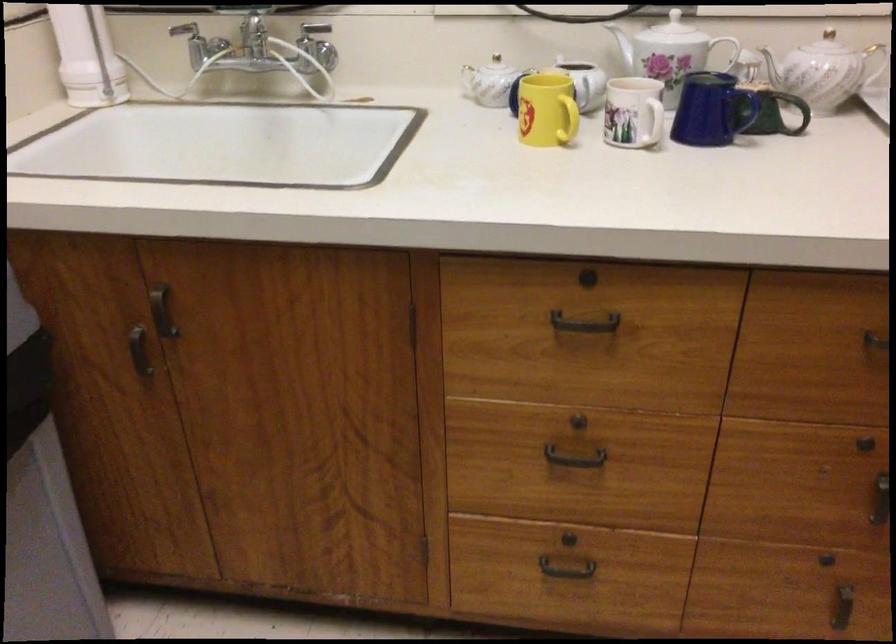
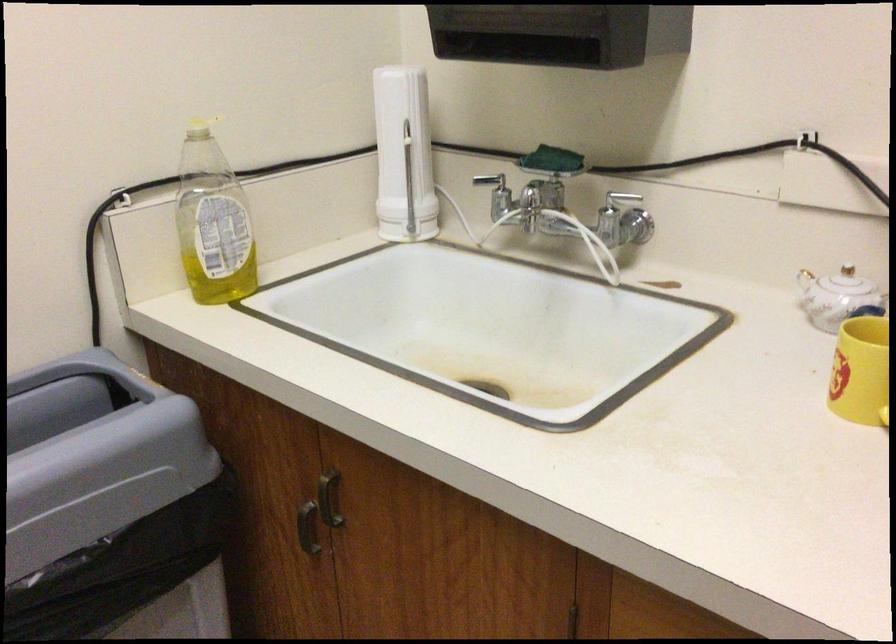
The point at (556, 138) is marked in the first image. Where is the corresponding point in the second image?

(877, 417)